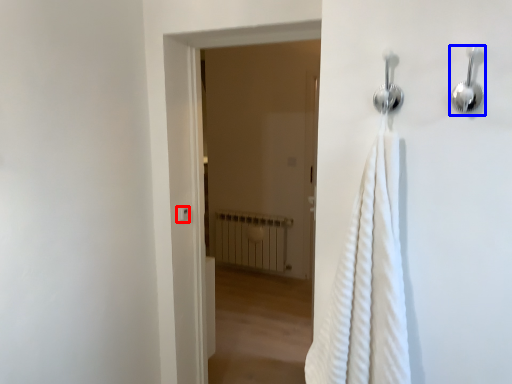
Question: Which of the following is the farthest to the observer, light switch (highlighted by a red box) or shower (highlighted by a blue box)?

Choices:
 (A) light switch
 (B) shower

Answer: (A)